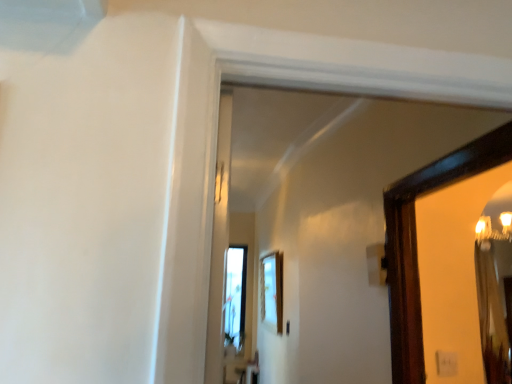
What do you see at coordinates (453, 272) in the screenshot? I see `wooden mirror at right` at bounding box center [453, 272].

Where is `wooden mirror at right`? The height and width of the screenshot is (384, 512). wooden mirror at right is located at coordinates (453, 272).

Identify the location of wooden mirror at right. (453, 272).